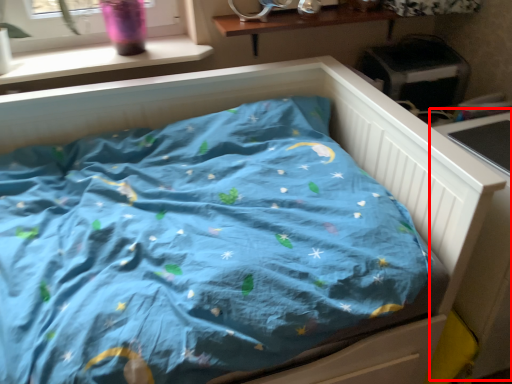
Question: From the image's perspective, what is the correct spatial positioning of table (annotated by the red box) in reference to window sill?

Choices:
 (A) above
 (B) below

Answer: (B)